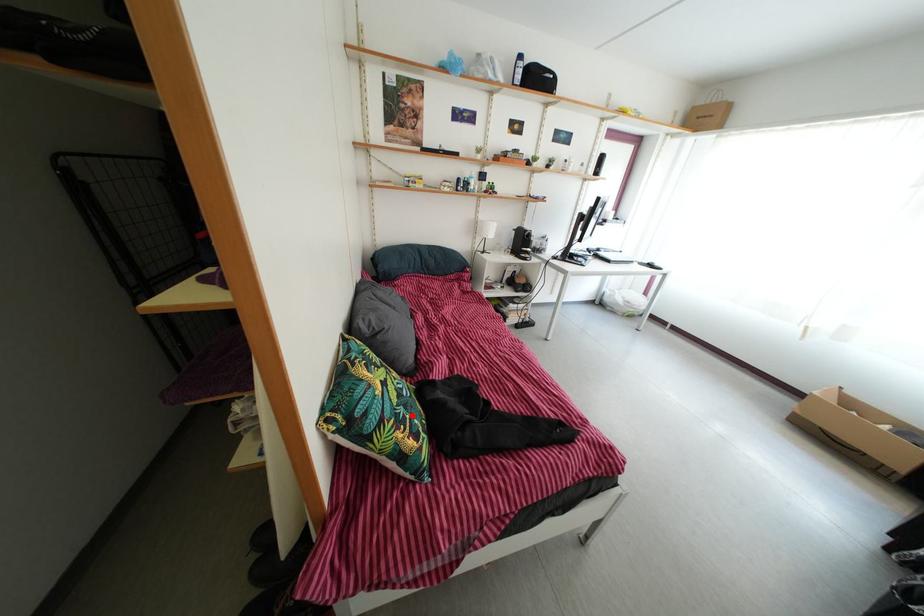
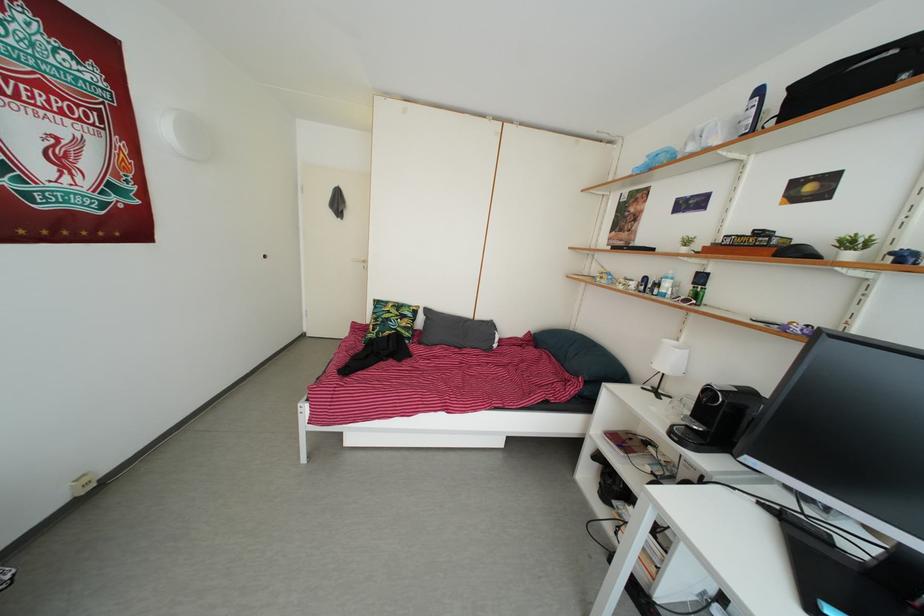
Question: I am providing you with two images of the same scene from different viewpoints. Image1 has a red point marked. In image2, the corresponding 3D location appears at what relative position? Reply with the corresponding letter.

Choices:
 (A) Closer
 (B) Farther

Answer: (B)